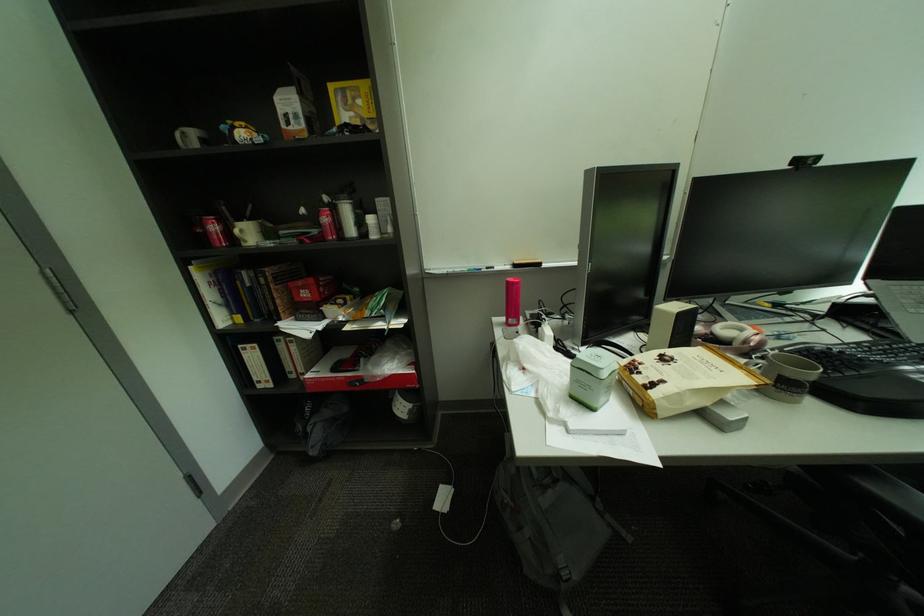
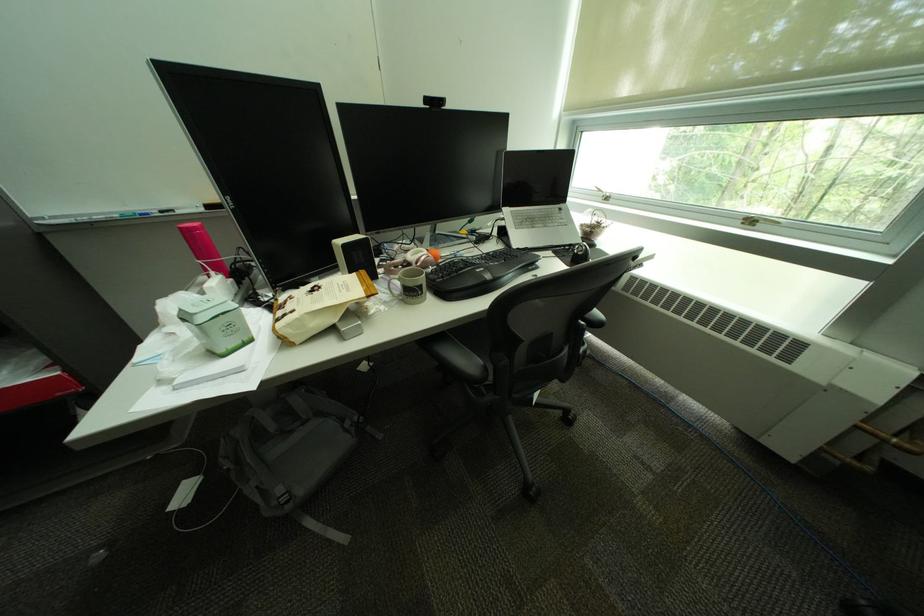
Locate, in the second image, the point that corresponds to point (817, 347) in the first image.

(463, 261)